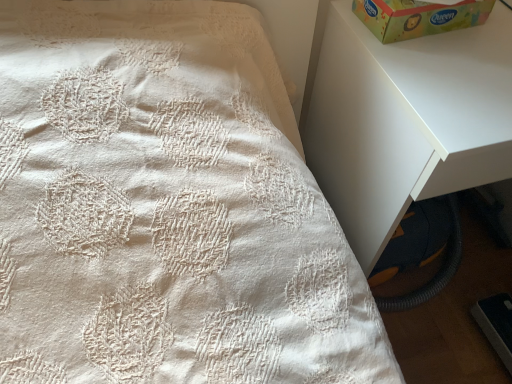
This screenshot has height=384, width=512. Describe the element at coordinates (418, 17) in the screenshot. I see `green paperboard box at upper right` at that location.

In order to face green paperboard box at upper right, should I rotate leftwards or rightwards?

Rotate right and turn 22.775 degrees.

Where is `green paperboard box at upper right`? The image size is (512, 384). green paperboard box at upper right is located at coordinates (418, 17).

In order to face white matte nightstand at upper right, should I rotate leftwards or rightwards?

Rotate right and turn 25.428 degrees.

Identify the location of white matte nightstand at upper right. Image resolution: width=512 pixels, height=384 pixels. (406, 120).

Describe the element at coordinates (406, 120) in the screenshot. I see `white matte nightstand at upper right` at that location.

Locate an element on the screen. Image resolution: width=512 pixels, height=384 pixels. green paperboard box at upper right is located at coordinates click(x=418, y=17).

Does white matte nightstand at upper right appear on the left side of green paperboard box at upper right?

No, white matte nightstand at upper right is not to the left of green paperboard box at upper right.

Consider the image. In the image, is white matte nightstand at upper right positioned in front of or behind green paperboard box at upper right?

white matte nightstand at upper right is positioned closer to the viewer than green paperboard box at upper right.

Does point (483, 45) come behind point (462, 7)?

Yes, it is behind point (462, 7).

From the image's perspective, which is below, white matte nightstand at upper right or green paperboard box at upper right?

white matte nightstand at upper right is shown below in the image.

From a real-world perspective, who is located higher, white matte nightstand at upper right or green paperboard box at upper right?

green paperboard box at upper right, from a real-world perspective.

Which object is thinner, white matte nightstand at upper right or green paperboard box at upper right?

With smaller width is green paperboard box at upper right.

In terms of height, does white matte nightstand at upper right look taller or shorter compared to green paperboard box at upper right?

In the image, white matte nightstand at upper right appears to be taller than green paperboard box at upper right.

Is white matte nightstand at upper right bigger than green paperboard box at upper right?

Yes, white matte nightstand at upper right is bigger than green paperboard box at upper right.

Is white matte nightstand at upper right surrounding green paperboard box at upper right?

No, green paperboard box at upper right is located outside of white matte nightstand at upper right.

Is white matte nightstand at upper right next to green paperboard box at upper right and touching it?

There is a gap between white matte nightstand at upper right and green paperboard box at upper right.

Is white matte nightstand at upper right turned away from green paperboard box at upper right?

No, green paperboard box at upper right is not at the back of white matte nightstand at upper right.

How many degrees apart are the facing directions of white matte nightstand at upper right and green paperboard box at upper right?

The angular difference between white matte nightstand at upper right and green paperboard box at upper right is 3.73 degrees.

Measure the distance from white matte nightstand at upper right to green paperboard box at upper right.

white matte nightstand at upper right is 6.80 inches away from green paperboard box at upper right.

Identify the location of box located on the left of white matte nightstand at upper right. The height and width of the screenshot is (384, 512). (418, 17).

Which is more to the left, green paperboard box at upper right or white matte nightstand at upper right?

green paperboard box at upper right is more to the left.

Which is in front, green paperboard box at upper right or white matte nightstand at upper right?

Positioned in front is white matte nightstand at upper right.

Which is further, (454,10) or (328,131)?

The point (328,131) is more distant.

Based on the photo, from the image's perspective, which one is positioned higher, green paperboard box at upper right or white matte nightstand at upper right?

green paperboard box at upper right.

From a real-world perspective, is green paperboard box at upper right beneath white matte nightstand at upper right?

No, from a real-world perspective, green paperboard box at upper right is not under white matte nightstand at upper right.

Considering the relative sizes of green paperboard box at upper right and white matte nightstand at upper right in the image provided, is green paperboard box at upper right wider than white matte nightstand at upper right?

No, green paperboard box at upper right is not wider than white matte nightstand at upper right.

Between green paperboard box at upper right and white matte nightstand at upper right, which one has more height?

white matte nightstand at upper right is taller.

Based on the photo, looking at the image, does green paperboard box at upper right seem bigger or smaller compared to white matte nightstand at upper right?

Considering their sizes, green paperboard box at upper right takes up less space than white matte nightstand at upper right.

Does green paperboard box at upper right contain white matte nightstand at upper right?

Definitely not — white matte nightstand at upper right is not inside green paperboard box at upper right.

Is green paperboard box at upper right far from white matte nightstand at upper right?

→ No.

Could you tell me if green paperboard box at upper right is turned towards white matte nightstand at upper right?

No, green paperboard box at upper right is not turned towards white matte nightstand at upper right.

At what (x,y) coordinates should I click in order to perform the action: click on nightstand lying on the right of green paperboard box at upper right. Please return your answer as a coordinate pair (x, y). The image size is (512, 384). Looking at the image, I should click on (406, 120).

Image resolution: width=512 pixels, height=384 pixels. What are the coordinates of `box above the white matte nightstand at upper right (from the image's perspective)` in the screenshot? It's located at (418, 17).

Where is `nightstand that appears in front of the green paperboard box at upper right`? This screenshot has height=384, width=512. nightstand that appears in front of the green paperboard box at upper right is located at coordinates (406, 120).